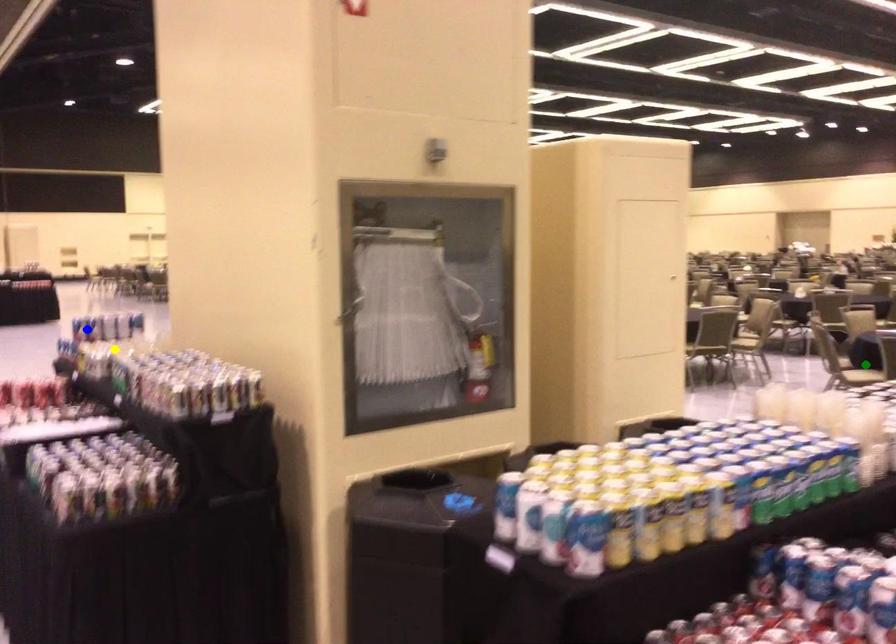
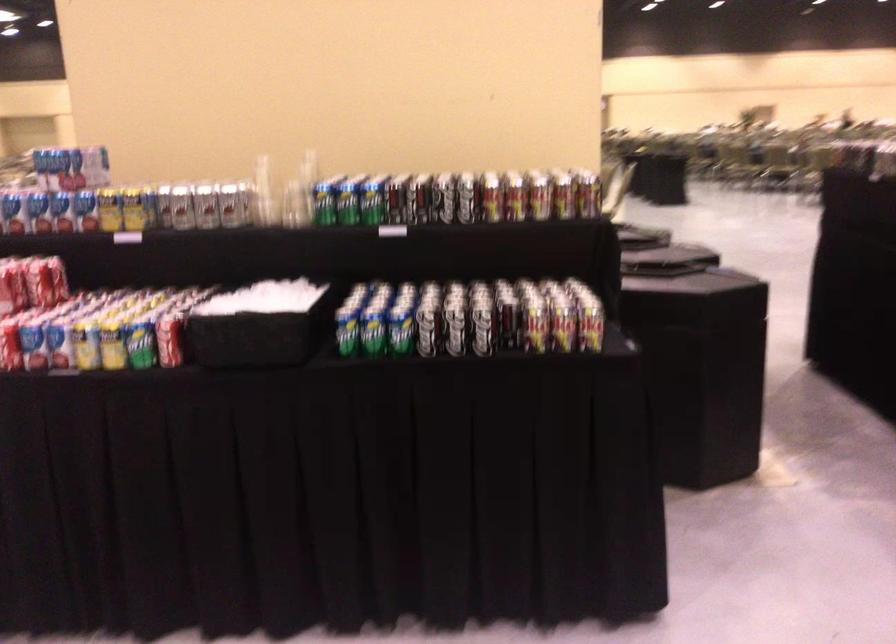
I am providing you with two images of the same scene from different viewpoints. Three points are marked in image1. Which point corresponds to a part or object that is occluded in image2?In image1, three points are marked. Which of them correspond to a part or object that is occluded in image2?Among the three points shown in image1, which one corresponds to a part or object that is no longer visible due to occlusion in image2?

Invisible in image2: green point.